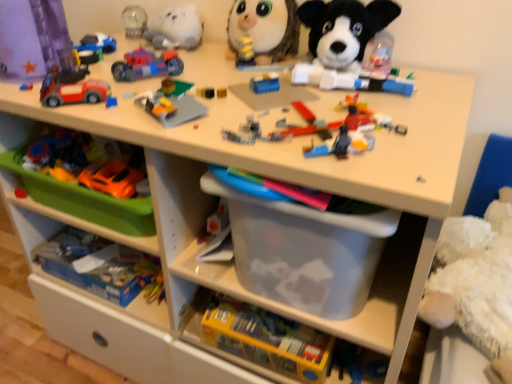
I want to click on free space between translucent plastic motorcycle at upper center, which ranks as the 6th toy in bottom-to-top order, and matte plastic car at upper left, which is the fifth toy from top to bottom, so click(120, 86).